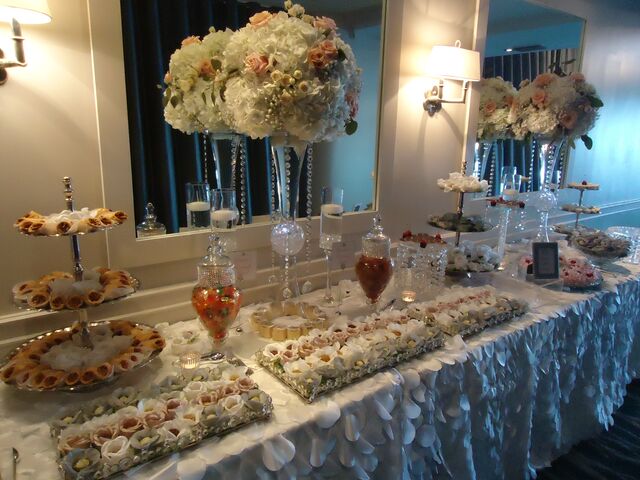
Identify the location of white tablecloth. This screenshot has height=480, width=640. (502, 414).